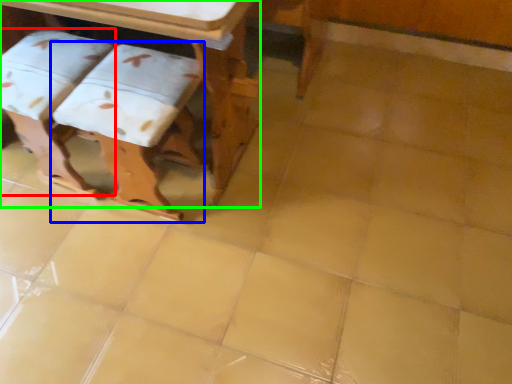
Question: Which object is the farthest from step stool (highlighted by a red box)? Choose among these: step stool (highlighted by a blue box) or table (highlighted by a green box).

Choices:
 (A) step stool
 (B) table

Answer: (B)